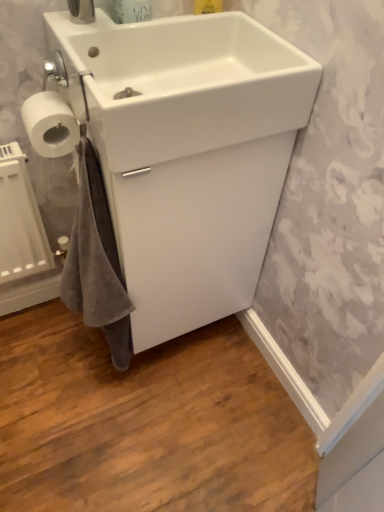
Question: Is white matte toilet paper at left at the right side of white glossy sink at upper center, the 1th sink viewed from the front?

Choices:
 (A) yes
 (B) no

Answer: (B)

Question: Would you say white matte toilet paper at left is outside white glossy sink at upper center, the 1th sink viewed from the front?

Choices:
 (A) yes
 (B) no

Answer: (A)

Question: Is white matte toilet paper at left positioned with its back to white glossy sink at upper center, the 1th sink viewed from the front?

Choices:
 (A) no
 (B) yes

Answer: (B)

Question: Does white matte toilet paper at left have a lesser height compared to white glossy sink at upper center, the 1th sink viewed from the front?

Choices:
 (A) no
 (B) yes

Answer: (B)

Question: Does white matte toilet paper at left have a greater height compared to white glossy sink at upper center, the 2th sink in the back-to-front sequence?

Choices:
 (A) no
 (B) yes

Answer: (A)

Question: Is white matte toilet paper at left behind white glossy sink at upper center, the 2th sink in the back-to-front sequence?

Choices:
 (A) no
 (B) yes

Answer: (B)

Question: Does white matte toilet paper at left appear on the right side of white glossy sink at center, marked as the second sink in a front-to-back arrangement?

Choices:
 (A) no
 (B) yes

Answer: (A)

Question: Does white matte toilet paper at left have a greater height compared to white glossy sink at center, the 1th sink when ordered from back to front?

Choices:
 (A) no
 (B) yes

Answer: (A)

Question: Is white matte toilet paper at left positioned far away from white glossy sink at center, marked as the second sink in a front-to-back arrangement?

Choices:
 (A) yes
 (B) no

Answer: (B)

Question: Is white matte toilet paper at left not within white glossy sink at center, the 1th sink when ordered from back to front?

Choices:
 (A) yes
 (B) no

Answer: (A)

Question: From the image's perspective, is white matte toilet paper at left below white glossy sink at center, marked as the second sink in a front-to-back arrangement?

Choices:
 (A) no
 (B) yes

Answer: (A)

Question: Does white matte toilet paper at left have a greater width compared to white glossy sink at center, marked as the second sink in a front-to-back arrangement?

Choices:
 (A) yes
 (B) no

Answer: (B)

Question: Is white glossy sink at upper center, the 2th sink in the back-to-front sequence, at the left side of white matte toilet paper at left?

Choices:
 (A) yes
 (B) no

Answer: (B)